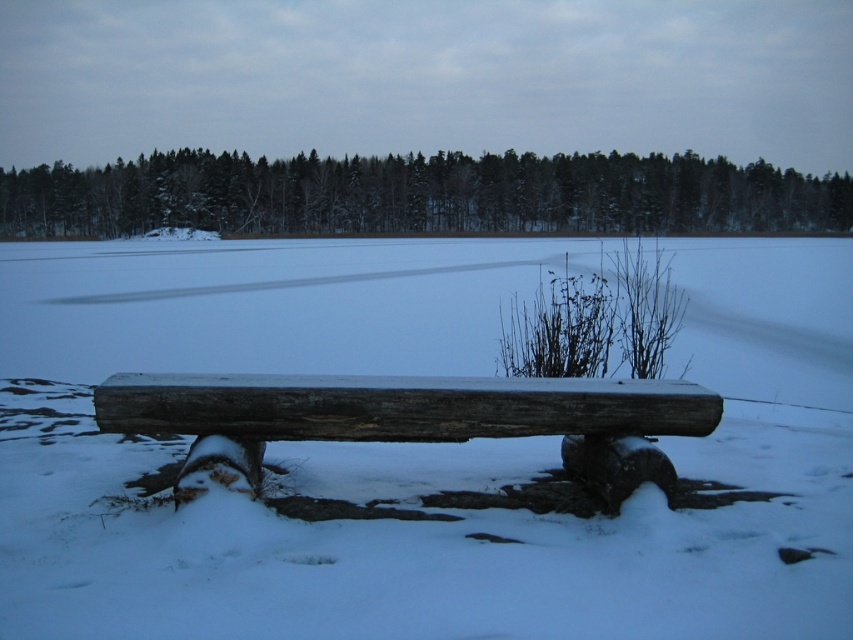
You are a winter hiker who wants to sit on the weathered wood bench at center. However, you notice the white snow at center is taller than the bench. Is the snow deep enough to cover the bench completely?

The white snow at center is taller than the weathered wood bench at center, which means the snow is deep enough to cover the bench completely.